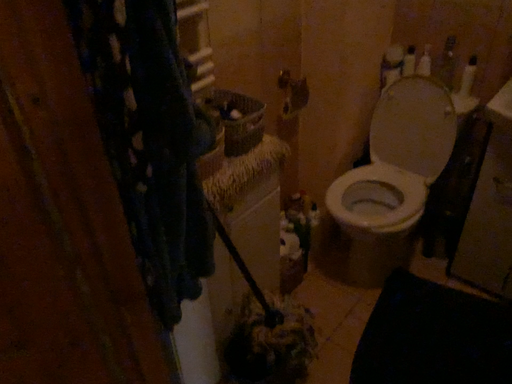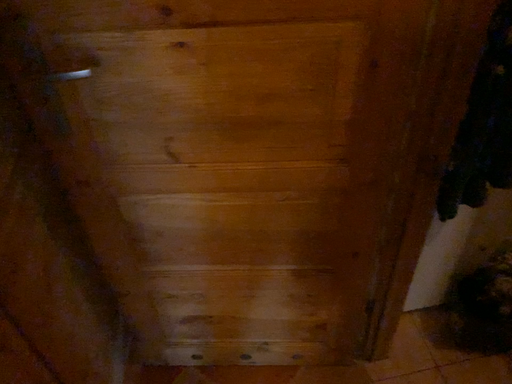
Question: Which way did the camera rotate in the video?

Choices:
 (A) rotated right
 (B) rotated left

Answer: (B)